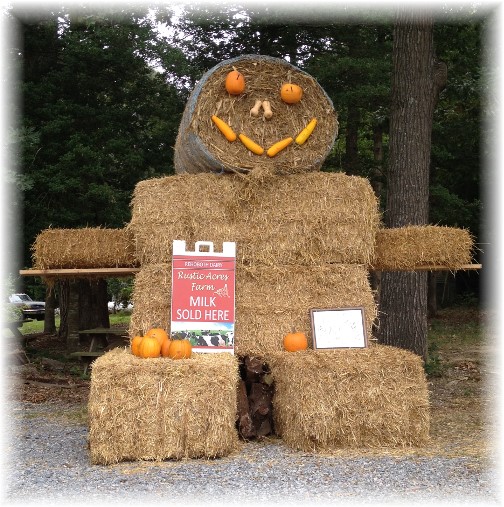
The width and height of the screenshot is (504, 507). I want to click on table, so click(96, 332), click(18, 327).